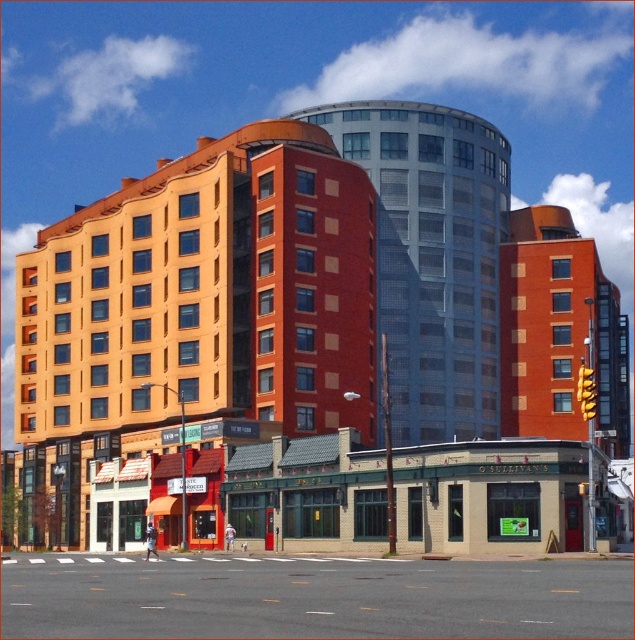
Question: Can you confirm if smooth glass building at center is positioned to the left of matte brick building at center-right?

Choices:
 (A) yes
 (B) no

Answer: (A)

Question: Is orange brick building at center bigger than matte brick building at center-right?

Choices:
 (A) no
 (B) yes

Answer: (B)

Question: Considering the real-world distances, which object is closest to the orange brick building at center?

Choices:
 (A) matte brick building at center-right
 (B) smooth glass building at center

Answer: (B)

Question: Which object appears farthest from the camera in this image?

Choices:
 (A) orange brick building at center
 (B) matte brick building at center-right

Answer: (B)

Question: Is orange brick building at center to the right of smooth glass building at center from the viewer's perspective?

Choices:
 (A) yes
 (B) no

Answer: (B)

Question: Which of the following is the farthest from the observer?

Choices:
 (A) (558, 248)
 (B) (29, 336)
 (C) (490, 209)

Answer: (B)